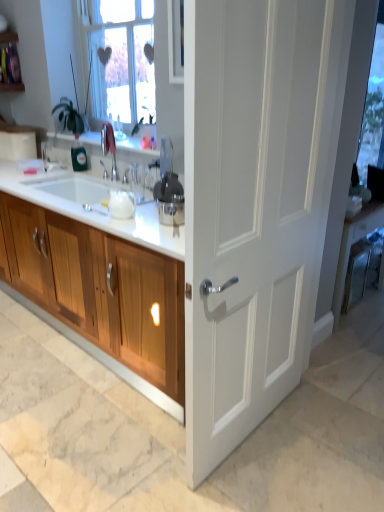
Question: From the image's perspective, is wooden cabinet at left below white matte door at center?

Choices:
 (A) yes
 (B) no

Answer: (A)

Question: Is wooden cabinet at left outside of white matte door at center?

Choices:
 (A) yes
 (B) no

Answer: (A)

Question: Is wooden cabinet at left directly adjacent to white matte door at center?

Choices:
 (A) no
 (B) yes

Answer: (A)

Question: From a real-world perspective, is wooden cabinet at left located higher than white matte door at center?

Choices:
 (A) yes
 (B) no

Answer: (B)

Question: Is wooden cabinet at left smaller than white matte door at center?

Choices:
 (A) yes
 (B) no

Answer: (B)

Question: From the image's perspective, is satin silver juicer at center located above or below white matte door at center?

Choices:
 (A) above
 (B) below

Answer: (A)

Question: Based on their sizes in the image, would you say satin silver juicer at center is bigger or smaller than white matte door at center?

Choices:
 (A) small
 (B) big

Answer: (A)

Question: Is satin silver juicer at center inside the boundaries of white matte door at center, or outside?

Choices:
 (A) outside
 (B) inside

Answer: (A)

Question: In the image, is satin silver juicer at center positioned in front of or behind white matte door at center?

Choices:
 (A) behind
 (B) front

Answer: (A)

Question: From the image's perspective, relative to white matte door at center, is transparent glass window screen at upper right above or below?

Choices:
 (A) above
 (B) below

Answer: (A)

Question: Looking at their shapes, would you say transparent glass window screen at upper right is wider or thinner than white matte door at center?

Choices:
 (A) wide
 (B) thin

Answer: (B)

Question: Based on their positions, is transparent glass window screen at upper right located to the left or right of white matte door at center?

Choices:
 (A) left
 (B) right

Answer: (B)

Question: From their relative heights in the image, would you say transparent glass window screen at upper right is taller or shorter than white matte door at center?

Choices:
 (A) tall
 (B) short

Answer: (B)

Question: Considering the positions of wooden cabinet at left and white matte door at center in the image, is wooden cabinet at left wider or thinner than white matte door at center?

Choices:
 (A) wide
 (B) thin

Answer: (A)

Question: Considering the positions of wooden cabinet at left and white matte door at center in the image, is wooden cabinet at left bigger or smaller than white matte door at center?

Choices:
 (A) big
 (B) small

Answer: (A)